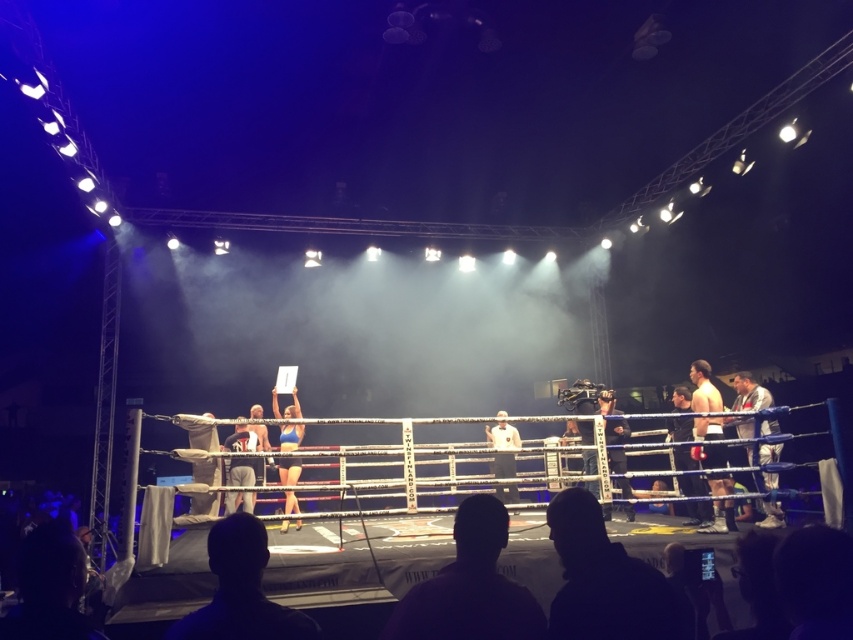
You are a photographer positioned at the center of the arena, aiming to capture a closeup shot of the referee holding the card. There are two points marked in the image at coordinates point (726, 464) and point (506, 496). Which point should you focus on to ensure the referee is in sharp focus?

You should focus on point (726, 464) because it is closer to the camera than point (506, 496), ensuring the referee is in sharp focus.